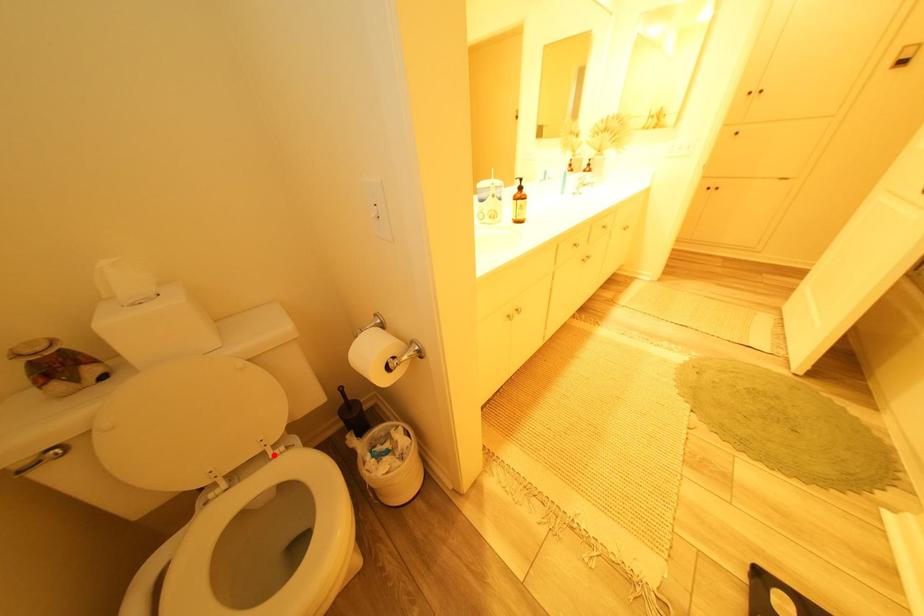
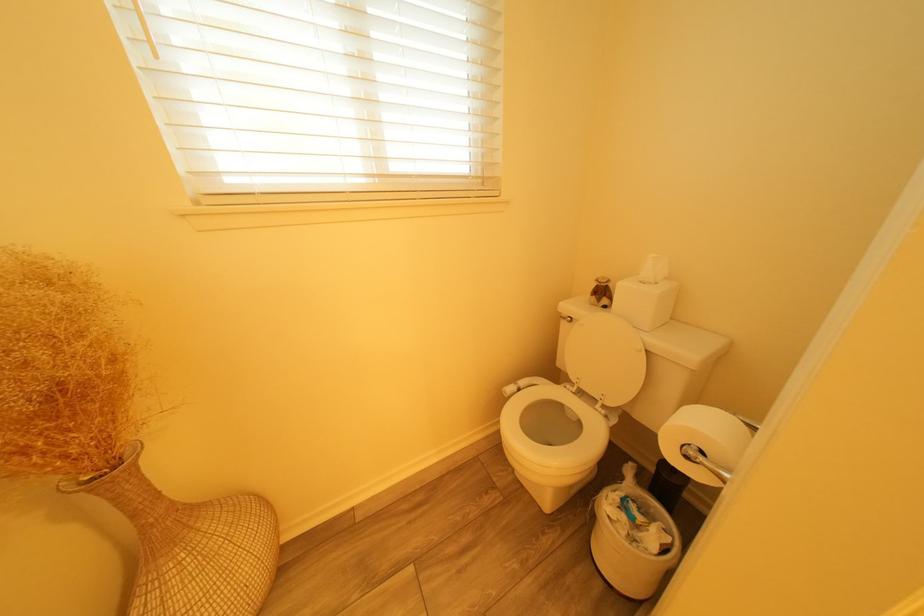
In the second image, find the point that corresponds to the highlighted location in the first image.

(608, 403)